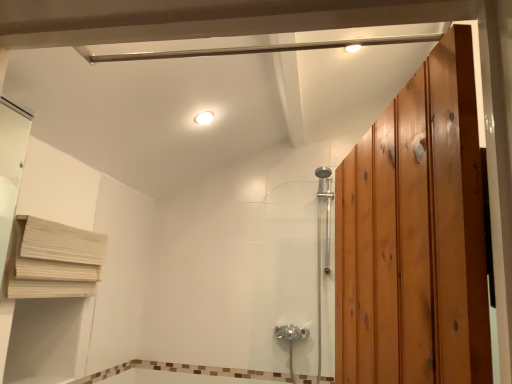
Question: From a real-world perspective, does chrome metallic shower door at center stand above white glossy light fixture at upper center?

Choices:
 (A) yes
 (B) no

Answer: (B)

Question: Is chrome metallic shower door at center turned away from white glossy light fixture at upper center?

Choices:
 (A) no
 (B) yes

Answer: (A)

Question: Are chrome metallic shower door at center and white glossy light fixture at upper center far apart?

Choices:
 (A) yes
 (B) no

Answer: (A)

Question: Is chrome metallic shower door at center not inside white glossy light fixture at upper center?

Choices:
 (A) no
 (B) yes

Answer: (B)

Question: Is chrome metallic shower door at center to the right of white glossy light fixture at upper center from the viewer's perspective?

Choices:
 (A) yes
 (B) no

Answer: (A)

Question: Considering the positions of point tap(206, 117) and point tap(31, 241), is point tap(206, 117) closer or farther from the camera than point tap(31, 241)?

Choices:
 (A) closer
 (B) farther

Answer: (B)

Question: Based on their sizes in the image, would you say white glossy light fixture at upper center is bigger or smaller than wooden at left?

Choices:
 (A) big
 (B) small

Answer: (B)

Question: Would you say white glossy light fixture at upper center is to the left or to the right of wooden at left in the picture?

Choices:
 (A) left
 (B) right

Answer: (B)

Question: Choose the correct answer: Is white glossy light fixture at upper center inside wooden at left or outside it?

Choices:
 (A) inside
 (B) outside

Answer: (B)

Question: In terms of height, does wooden at left look taller or shorter compared to brown mosaic tile at lower center?

Choices:
 (A) short
 (B) tall

Answer: (B)

Question: Relative to brown mosaic tile at lower center, is wooden at left in front or behind?

Choices:
 (A) behind
 (B) front

Answer: (B)

Question: From a real-world perspective, relative to brown mosaic tile at lower center, is wooden at left vertically above or below?

Choices:
 (A) above
 (B) below

Answer: (A)

Question: Would you say wooden at left is inside or outside brown mosaic tile at lower center?

Choices:
 (A) inside
 (B) outside

Answer: (B)

Question: Is chrome metallic shower door at center to the left or to the right of wooden at left in the image?

Choices:
 (A) left
 (B) right

Answer: (B)

Question: In terms of height, does chrome metallic shower door at center look taller or shorter compared to wooden at left?

Choices:
 (A) tall
 (B) short

Answer: (A)